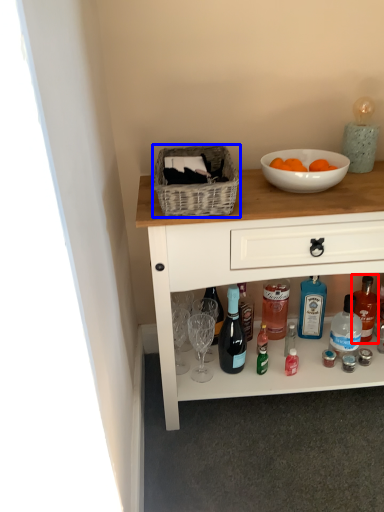
Question: Which object is closer to the camera taking this photo, bottle (highlighted by a red box) or picnic basket (highlighted by a blue box)?

Choices:
 (A) bottle
 (B) picnic basket

Answer: (B)